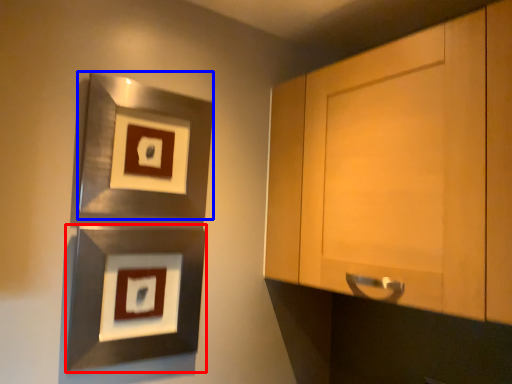
Question: Among these objects, which one is nearest to the camera, picture frame (highlighted by a red box) or picture frame (highlighted by a blue box)?

Choices:
 (A) picture frame
 (B) picture frame

Answer: (A)